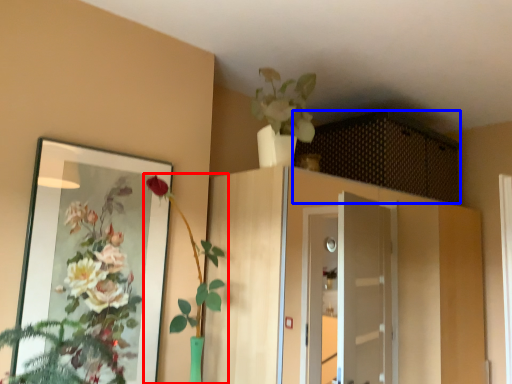
Question: Among these objects, which one is farthest to the camera, houseplant (highlighted by a red box) or cabinetry (highlighted by a blue box)?

Choices:
 (A) houseplant
 (B) cabinetry

Answer: (B)